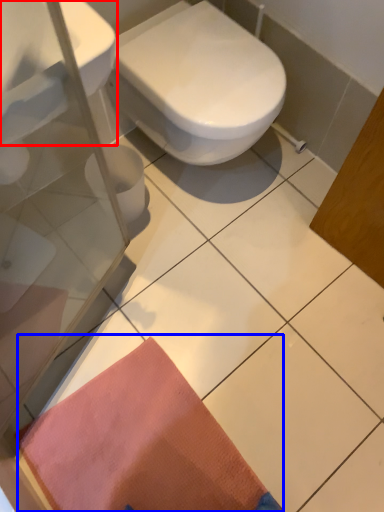
Question: Which object is closer to the camera taking this photo, sink (highlighted by a red box) or doormat (highlighted by a blue box)?

Choices:
 (A) sink
 (B) doormat

Answer: (A)